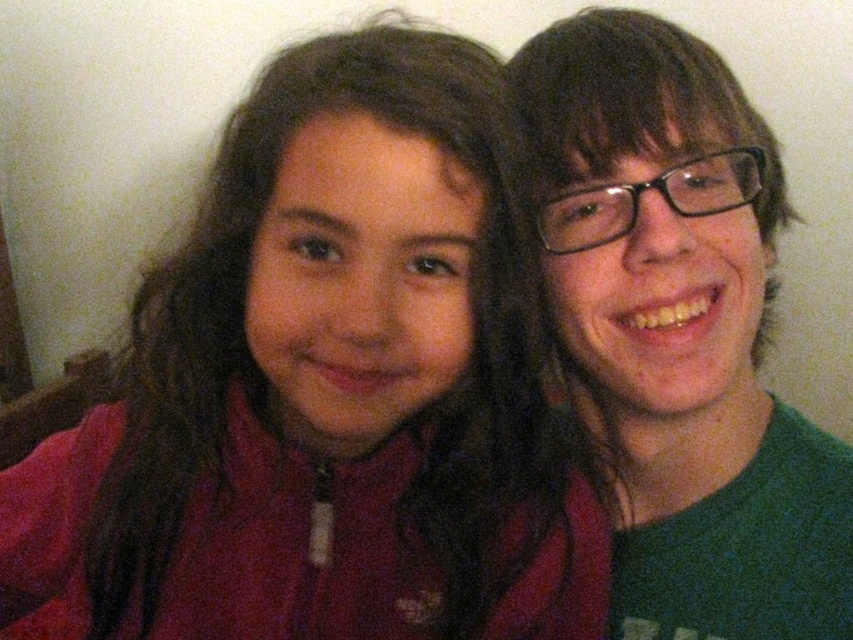
Based on the photo, you are a photographer trying to adjust the lighting for a portrait. You notice the matte red jacket at center and the green matte shirt at right. Which object is closer to the bottom edge of the photo?

The matte red jacket at center is positioned under the green matte shirt at right, so it is closer to the bottom edge of the photo.

You are a photographer trying to adjust the camera focus. The matte red jacket at center and the green matte shirt at right are both in the frame. Which object should you focus on first if you want to ensure the taller one is in focus?

The matte red jacket at center is taller than the green matte shirt at right, so you should focus on the matte red jacket at center first to ensure it is in focus.

You are a photographer trying to focus on the matte red jacket at center in the image. What are the coordinates where you should adjust your camera focus to ensure the jacket is sharp?

The coordinates for the matte red jacket at center are at point (326, 388), so you should adjust your camera focus to that point to ensure the jacket is sharp.